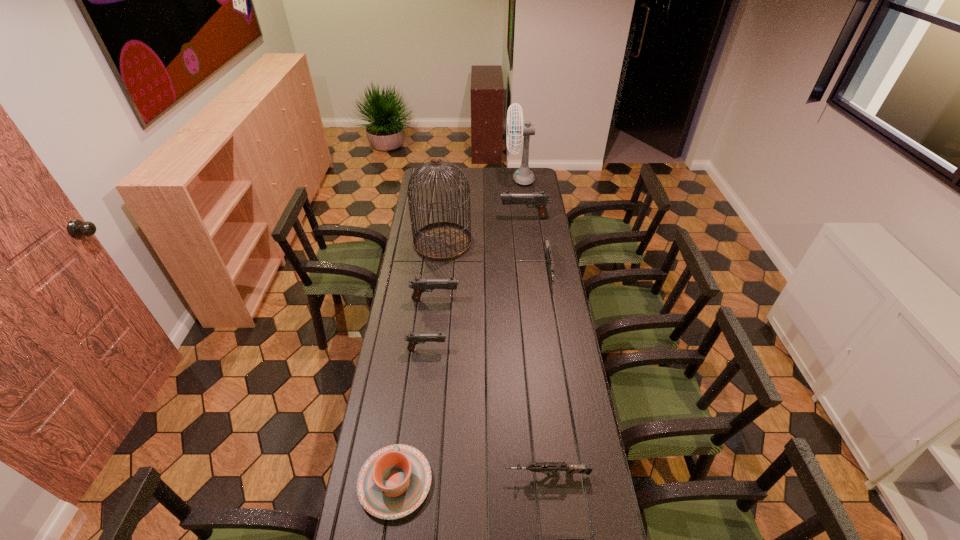
You are a GUI agent. You are given a task and a screenshot of the screen. Output one action in this format:
    pyautogui.click(x=<x>, y=<y>)
    Task: Click on the vacant point located 0.210m in the direction the farthest gray gun is aimed
    
    Given the screenshot: What is the action you would take?
    pyautogui.click(x=462, y=218)

The width and height of the screenshot is (960, 540). In order to click on vacant region located 0.180m in the direction the third farthest gun is aimed in this screenshot , I will do `click(499, 300)`.

Identify the location of free space located in the direction the smallest gray gun is aimed. (516, 349).

This screenshot has height=540, width=960. In order to click on free space located aimed along the barrel of the biggest grey gun in this screenshot , I will do `click(557, 318)`.

At what (x,y) coordinates should I click in order to perform the action: click on vacant space situated on the handle side of the pink chinaware. Please return your answer as a coordinate pair (x, y). The image size is (960, 540). Looking at the image, I should click on (412, 361).

This screenshot has width=960, height=540. I want to click on blank space located 0.290m on the handle side of the pink chinaware, so click(410, 374).

Where is `vacant space located 0.190m on the handle side of the pink chinaware`? This screenshot has height=540, width=960. vacant space located 0.190m on the handle side of the pink chinaware is located at coordinates (407, 397).

You are a GUI agent. You are given a task and a screenshot of the screen. Output one action in this format:
    pyautogui.click(x=<x>, y=<y>)
    Task: Click on the free space located 0.370m aimed along the barrel of the second shortest gun
    The width and height of the screenshot is (960, 540).
    Given the screenshot: What is the action you would take?
    pyautogui.click(x=389, y=475)

The width and height of the screenshot is (960, 540). Find the location of `vacant space located 0.070m aimed along the barrel of the second shortest gun`. vacant space located 0.070m aimed along the barrel of the second shortest gun is located at coordinates (483, 475).

The image size is (960, 540). What are the coordinates of `free spot located 0.100m aimed along the barrel of the second shortest gun` in the screenshot? It's located at (473, 475).